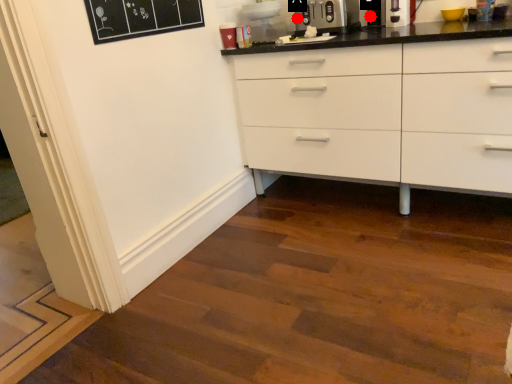
Question: Two points are circled on the image, labeled by A and B beside each circle. Which point is closer to the camera?

Choices:
 (A) A is closer
 (B) B is closer

Answer: (B)